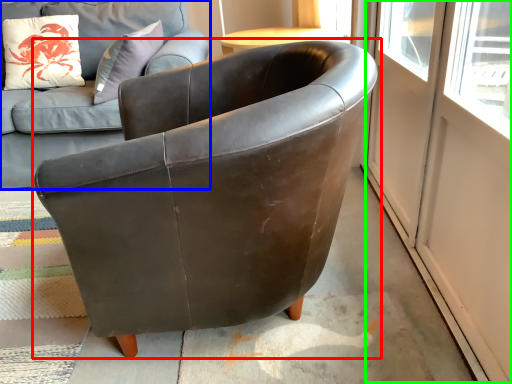
Question: Estimate the real-world distances between objects in this image. Which object is farther from chair (highlighted by a red box), studio couch (highlighted by a blue box) or screen door (highlighted by a green box)?

Choices:
 (A) studio couch
 (B) screen door

Answer: (A)